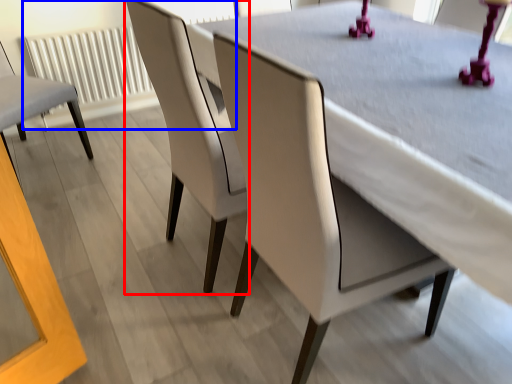
Question: Which of the following is the farthest to the observer, chair (highlighted by a red box) or radiator (highlighted by a blue box)?

Choices:
 (A) chair
 (B) radiator

Answer: (B)